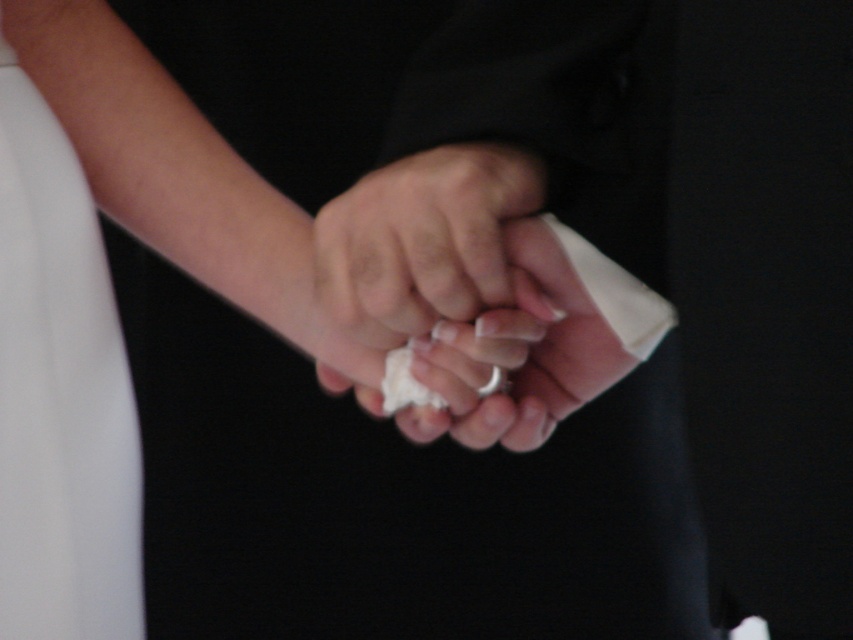
You are standing in front of the image and notice two hands clasped together. There is a point at coordinates (61, 394). What object is located at that point?

The point at coordinates (61, 394) is where the white satin dress at left is located.

You are a photographer setting up a photoshoot. You have a white satin dress at left and a silver metallic ring at center. You want to ensure that the dress is wider than the ring in the final image. Based on the scene description, can you confirm if this will be the case?

The white satin dress at left might be wider than silver metallic ring at center according to the description, so it is possible that the dress will appear wider in the image.

You are a photographer adjusting the focus on a camera. You notice two points in the image at coordinates point (65,182) and point (529,163). Which point should you focus on first if you want to ensure the closest object is sharp?

Point (65,182) is further to the camera than point (529,163), so you should focus on point (65,182) first to ensure the closest object is sharp.